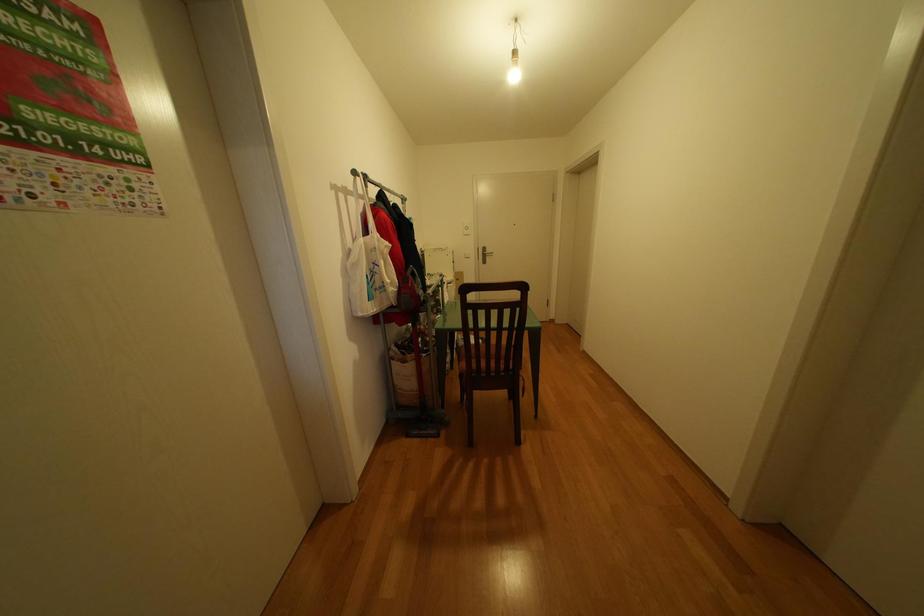
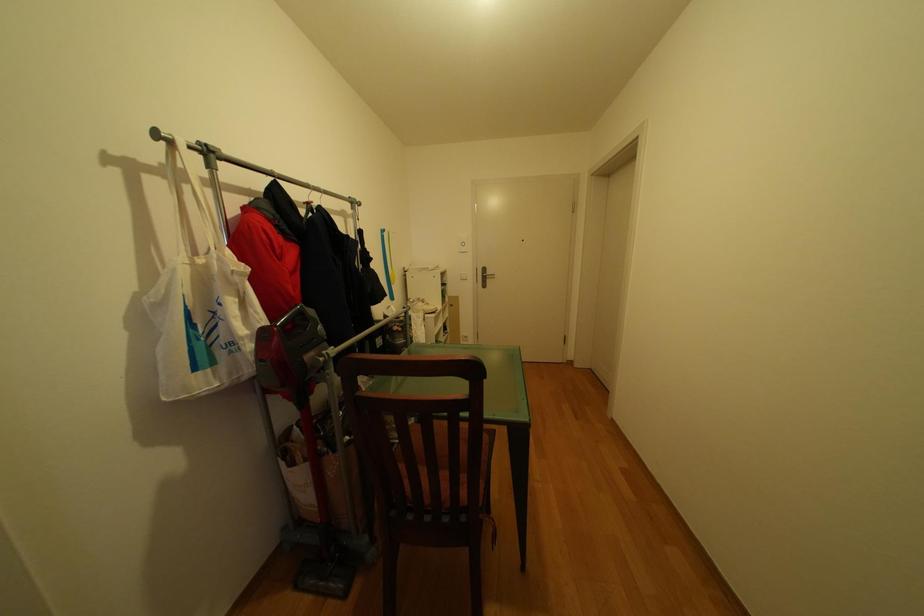
Question: How did the camera likely rotate?

Choices:
 (A) Left
 (B) Right
 (C) Up
 (D) Down

Answer: (A)